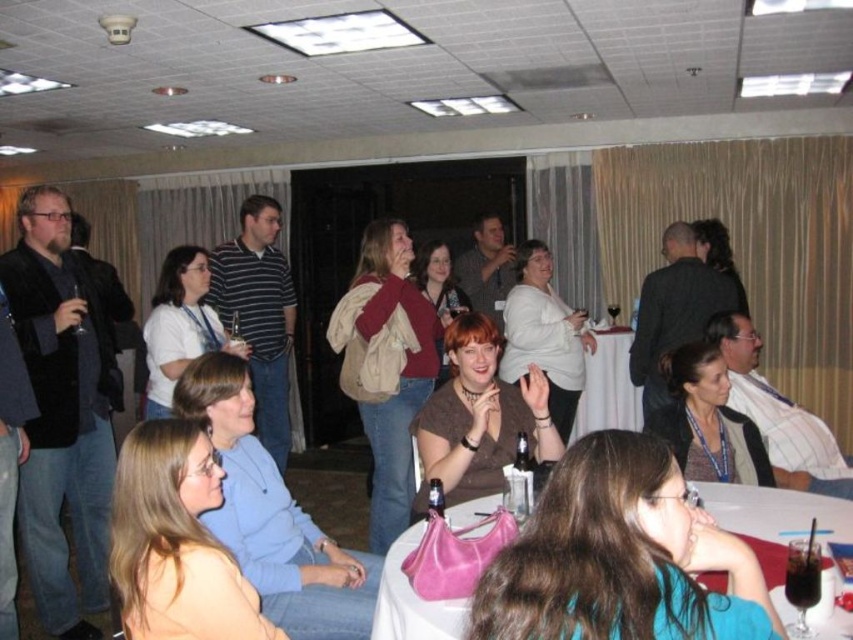
You are at a party and want to place both the dark brown glass at lower right and the translucent plastic bottle at center on a small shelf. Which item should you place first to ensure both fit?

You should place the translucent plastic bottle at center first because the dark brown glass at lower right occupies less space and can fit into the remaining space.

You are a guest at this event and want to take a photo of the brown matte shirt at center and the matte brown sweater at center. Which one should you focus on first to ensure both are in the frame?

The brown matte shirt at center is in front of the matte brown sweater at center, so you should focus on the matte brown sweater at center first to ensure both are in the frame.

You are a guest at this event and want to grab a drink. You see the dark brown glass at lower right and the translucent plastic bottle at center. Which one is positioned lower in the image?

The dark brown glass at lower right is positioned lower than the translucent plastic bottle at center.